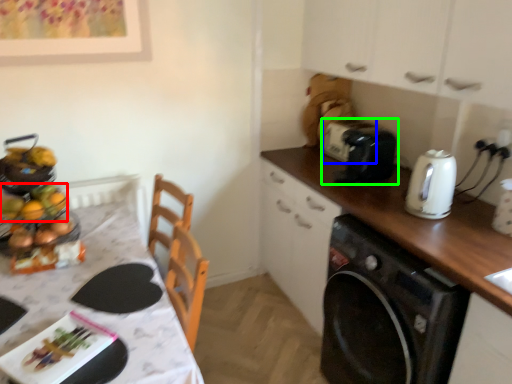
Question: Estimate the real-world distances between objects in this image. Which object is closer to food (highlighted by a red box), appliance (highlighted by a blue box) or toaster (highlighted by a green box)?

Choices:
 (A) appliance
 (B) toaster

Answer: (B)